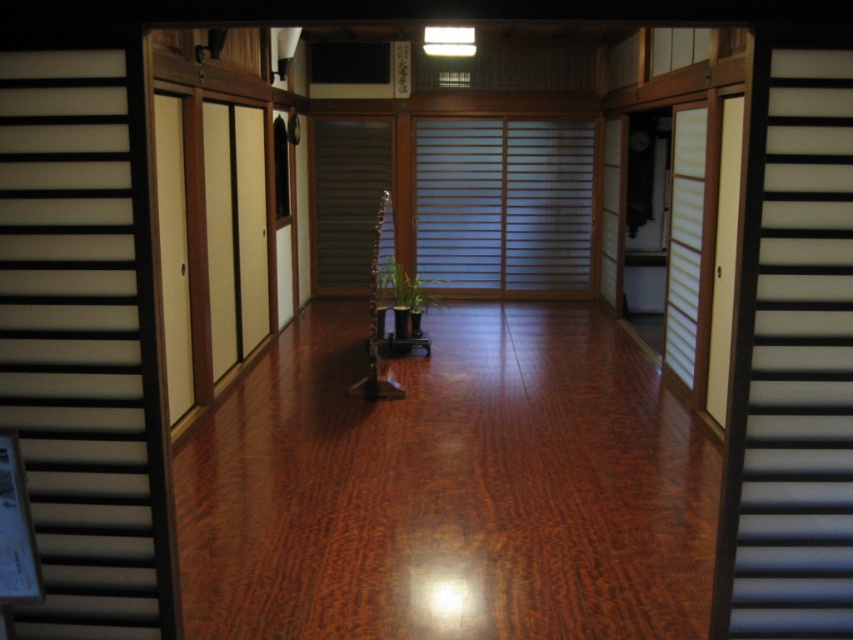
Question: Which of the following is the closest to the observer?

Choices:
 (A) white matte sliding door at left
 (B) shiny brown wood at center
 (C) brown wooden stairs at center

Answer: (A)

Question: Does shiny brown wood at center appear on the right side of white matte sliding door at left?

Choices:
 (A) yes
 (B) no

Answer: (A)

Question: Does black wood stair at right appear under brown wooden stairs at center?

Choices:
 (A) no
 (B) yes

Answer: (B)

Question: Estimate the real-world distances between objects in this image. Which object is farther from the black wood stair at right?

Choices:
 (A) white matte sliding door at left
 (B) shiny brown wood at center

Answer: (B)

Question: Which point is closer to the camera taking this photo?

Choices:
 (A) (850, 264)
 (B) (321, 163)
 (C) (41, 483)
 (D) (563, 502)

Answer: (A)

Question: Is shiny brown wood at center closer to camera compared to black wood stair at right?

Choices:
 (A) no
 (B) yes

Answer: (A)